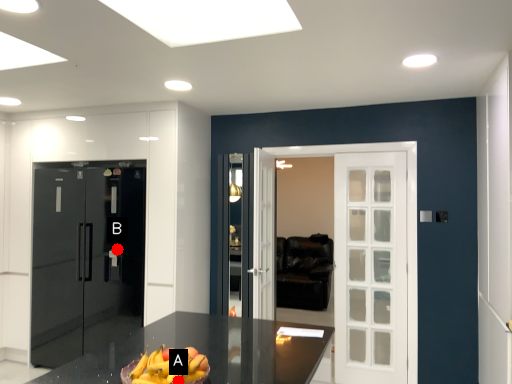
Question: Two points are circled on the image, labeled by A and B beside each circle. Which point is further to the camera?

Choices:
 (A) A is further
 (B) B is further

Answer: (B)